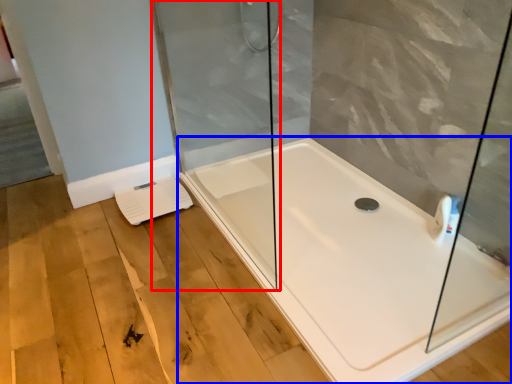
Question: Among these objects, which one is farthest to the camera, shower door (highlighted by a red box) or bathtub (highlighted by a blue box)?

Choices:
 (A) shower door
 (B) bathtub

Answer: (A)